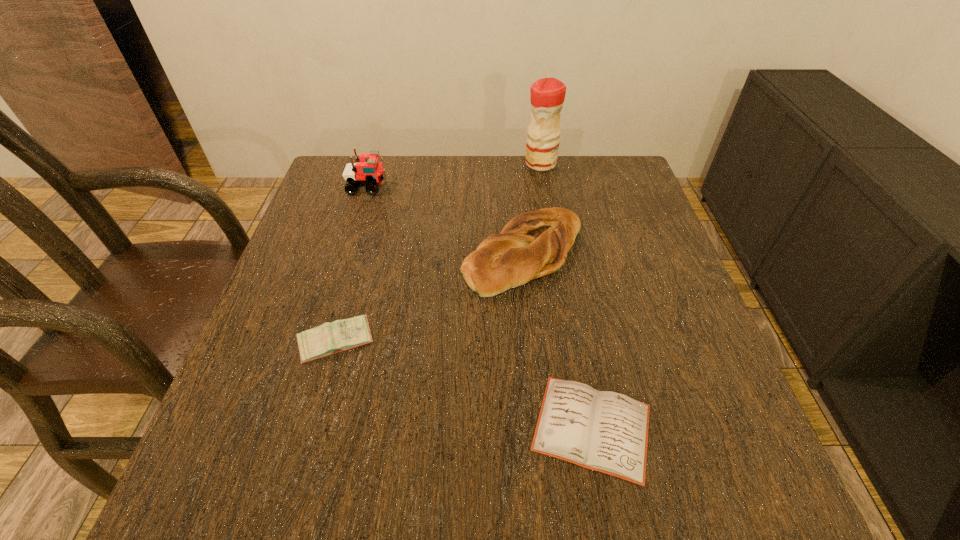
In order to click on free space at the near right corner of the desktop in this screenshot , I will do `click(666, 490)`.

Identify the location of free space between the farther diary and the tallest object. Image resolution: width=960 pixels, height=540 pixels. (438, 253).

Identify the location of vacant area that lies between the third farthest object and the condiment. The image size is (960, 540). (532, 209).

The height and width of the screenshot is (540, 960). What are the coordinates of `free spot between the farthest object and the nearer diary` in the screenshot? It's located at (566, 295).

Find the location of a particular element. The width and height of the screenshot is (960, 540). vacant area that lies between the second shortest object and the third shortest object is located at coordinates (430, 298).

Locate an element on the screen. free space between the left diary and the condiment is located at coordinates (438, 253).

I want to click on free spot between the nearer diary and the fourth shortest object, so click(480, 307).

This screenshot has height=540, width=960. I want to click on free point between the nearer diary and the third nearest object, so click(558, 341).

At what (x,y) coordinates should I click in order to perform the action: click on unoccupied area between the tallest object and the right diary. Please return your answer as a coordinate pair (x, y). Image resolution: width=960 pixels, height=540 pixels. Looking at the image, I should click on [x=566, y=295].

This screenshot has height=540, width=960. Identify the location of free spot between the third farthest object and the tallest object. (532, 209).